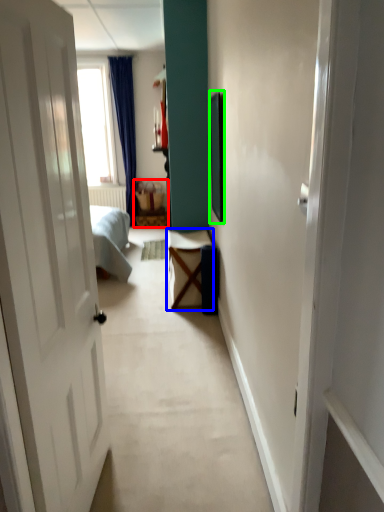
Question: Based on their relative distances, which object is nearer to furniture (highlighted by a red box)? Choose from table (highlighted by a blue box) and picture frame (highlighted by a green box).

Choices:
 (A) table
 (B) picture frame

Answer: (B)